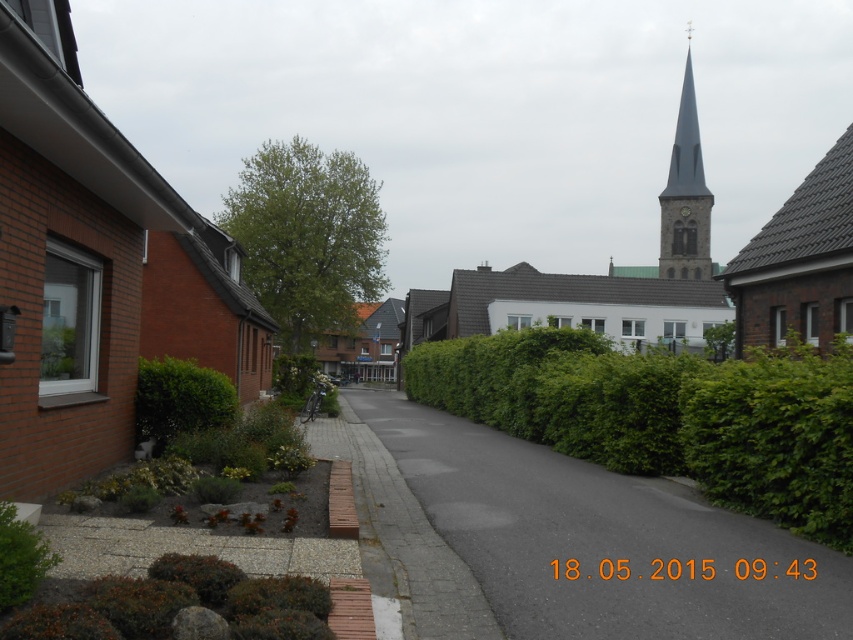
Is point (650, 589) farther from viewer compared to point (257, 234)?

No, (650, 589) is closer to viewer.

Can you confirm if asphalt at center is smaller than green leafy bush at center?

Indeed, asphalt at center has a smaller size compared to green leafy bush at center.

Measure the distance between asphalt at center and camera.

The distance of asphalt at center from camera is 4.31 meters.

The image size is (853, 640). I want to click on asphalt at center, so click(602, 540).

Between point (18, 179) and point (703, 294), which one is positioned behind?

The point (703, 294) is more distant.

Does point (155, 301) come in front of point (654, 266)?

Yes.

Does point (144, 192) lie in front of point (685, 204)?

Yes.

Identify the location of brick church at left. (97, 269).

Does gray stone steeple at upper center have a smaller size compared to green leafy bush at lower left?

Actually, gray stone steeple at upper center might be larger than green leafy bush at lower left.

Is gray stone steeple at upper center to the left of green leafy bush at lower left from the viewer's perspective?

Incorrect, gray stone steeple at upper center is not on the left side of green leafy bush at lower left.

Identify the location of gray stone steeple at upper center. (685, 196).